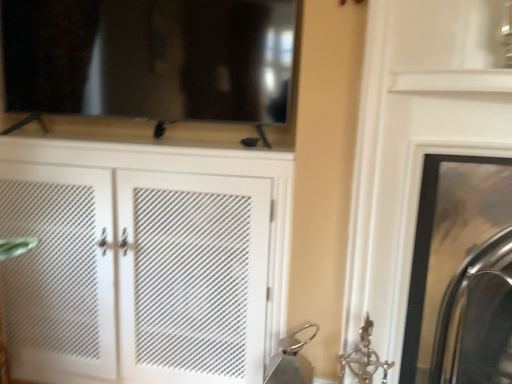
Question: From the image's perspective, relative to metallic silver fireplace at right, is white mesh cabinet at center above or below?

Choices:
 (A) below
 (B) above

Answer: (B)

Question: In the image, is white mesh cabinet at center on the left side or the right side of metallic silver fireplace at right?

Choices:
 (A) left
 (B) right

Answer: (A)

Question: Is white mesh cabinet at center situated inside metallic silver fireplace at right or outside?

Choices:
 (A) outside
 (B) inside

Answer: (A)

Question: Based on their sizes in the image, would you say metallic silver fireplace at right is bigger or smaller than white mesh cabinet at center?

Choices:
 (A) big
 (B) small

Answer: (B)

Question: From the image's perspective, is metallic silver fireplace at right above or below white mesh cabinet at center?

Choices:
 (A) below
 (B) above

Answer: (A)

Question: From a real-world perspective, is metallic silver fireplace at right physically located above or below white mesh cabinet at center?

Choices:
 (A) below
 (B) above

Answer: (B)

Question: From their relative heights in the image, would you say metallic silver fireplace at right is taller or shorter than white mesh cabinet at center?

Choices:
 (A) tall
 (B) short

Answer: (B)